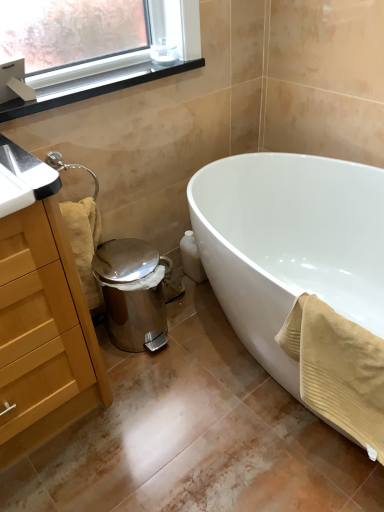
Question: From a real-world perspective, is beige textured towel at lower left, which is the 2th bath towel from right to left, positioned over white glossy bathtub at lower right based on gravity?

Choices:
 (A) no
 (B) yes

Answer: (B)

Question: Considering the relative sizes of beige textured towel at lower left, positioned as the second bath towel in front-to-back order, and white glossy bathtub at lower right in the image provided, is beige textured towel at lower left, positioned as the second bath towel in front-to-back order, smaller than white glossy bathtub at lower right?

Choices:
 (A) yes
 (B) no

Answer: (A)

Question: Does beige textured towel at lower left, which is the 2th bath towel from right to left, come behind white glossy bathtub at lower right?

Choices:
 (A) no
 (B) yes

Answer: (B)

Question: Is beige textured towel at lower left, the first bath towel positioned from the back, at the left side of white glossy bathtub at lower right?

Choices:
 (A) yes
 (B) no

Answer: (A)

Question: From the image's perspective, is beige textured towel at lower left, the first bath towel positioned from the back, on top of white glossy bathtub at lower right?

Choices:
 (A) yes
 (B) no

Answer: (A)

Question: From the image's perspective, is black plastic window sill at upper left located above or below white glossy bathtub at lower right?

Choices:
 (A) below
 (B) above

Answer: (B)

Question: Visually, is black plastic window sill at upper left positioned to the left or to the right of white glossy bathtub at lower right?

Choices:
 (A) left
 (B) right

Answer: (A)

Question: In the image, is black plastic window sill at upper left positioned in front of or behind white glossy bathtub at lower right?

Choices:
 (A) behind
 (B) front

Answer: (A)

Question: From their relative heights in the image, would you say black plastic window sill at upper left is taller or shorter than white glossy bathtub at lower right?

Choices:
 (A) short
 (B) tall

Answer: (A)

Question: Based on their positions, is black plastic window sill at upper left located to the left or right of beige textured towel at lower left, the first bath towel from the left?

Choices:
 (A) left
 (B) right

Answer: (B)

Question: Relative to beige textured towel at lower left, the first bath towel positioned from the back, is black plastic window sill at upper left in front or behind?

Choices:
 (A) behind
 (B) front

Answer: (B)

Question: Is black plastic window sill at upper left situated inside beige textured towel at lower left, the first bath towel positioned from the back, or outside?

Choices:
 (A) inside
 (B) outside

Answer: (B)

Question: From their relative heights in the image, would you say black plastic window sill at upper left is taller or shorter than beige textured towel at lower left, the first bath towel from the left?

Choices:
 (A) tall
 (B) short

Answer: (B)

Question: From their relative heights in the image, would you say white glossy bathtub at lower right is taller or shorter than wooden cabinet at left?

Choices:
 (A) short
 (B) tall

Answer: (A)

Question: From the image's perspective, is white glossy bathtub at lower right above or below wooden cabinet at left?

Choices:
 (A) above
 (B) below

Answer: (A)